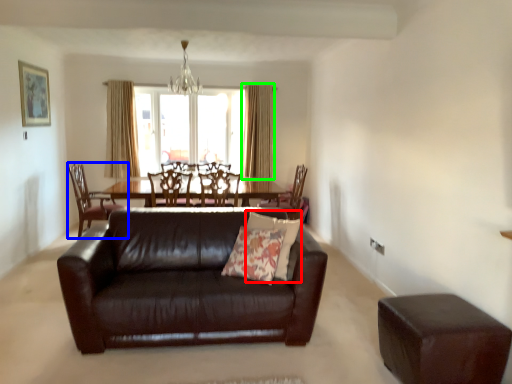
Question: Which is farther away from pillow (highlighted by a red box)? chair (highlighted by a blue box) or curtain (highlighted by a green box)?

Choices:
 (A) chair
 (B) curtain

Answer: (B)